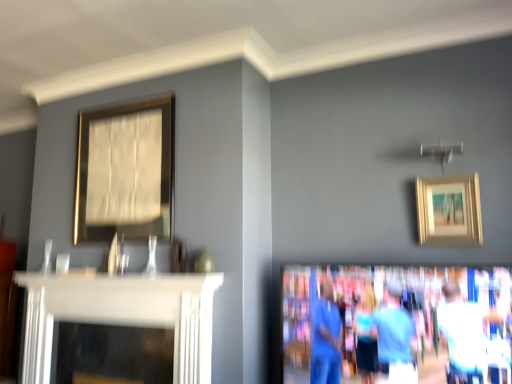
Question: Can you confirm if blue fabric couple at lower right is shorter than gold/golden frame at upper right, which ranks as the 1th picture frame in right-to-left order?

Choices:
 (A) no
 (B) yes

Answer: (A)

Question: From the image's perspective, is blue fabric couple at lower right located beneath gold/golden frame at upper right, the first picture frame from the front?

Choices:
 (A) no
 (B) yes

Answer: (B)

Question: Can we say blue fabric couple at lower right lies outside gold/golden frame at upper right, the first picture frame from the front?

Choices:
 (A) no
 (B) yes

Answer: (B)

Question: Is blue fabric couple at lower right aimed at gold/golden frame at upper right, which ranks as the 1th picture frame in right-to-left order?

Choices:
 (A) yes
 (B) no

Answer: (B)

Question: Considering the relative positions of blue fabric couple at lower right and gold/golden frame at upper right, acting as the second picture frame starting from the left, in the image provided, is blue fabric couple at lower right to the left of gold/golden frame at upper right, acting as the second picture frame starting from the left, from the viewer's perspective?

Choices:
 (A) yes
 (B) no

Answer: (A)

Question: Considering the relative sizes of blue fabric couple at lower right and gold/golden frame at upper right, the first picture frame from the front, in the image provided, is blue fabric couple at lower right taller than gold/golden frame at upper right, the first picture frame from the front,?

Choices:
 (A) yes
 (B) no

Answer: (A)

Question: Does blue fabric couple at lower right have a smaller size compared to white glossy fireplace at left?

Choices:
 (A) no
 (B) yes

Answer: (B)

Question: Is blue fabric couple at lower right not within white glossy fireplace at left?

Choices:
 (A) yes
 (B) no

Answer: (A)

Question: Is blue fabric couple at lower right wider than white glossy fireplace at left?

Choices:
 (A) no
 (B) yes

Answer: (A)

Question: Is blue fabric couple at lower right closer to the viewer compared to white glossy fireplace at left?

Choices:
 (A) no
 (B) yes

Answer: (B)

Question: Is blue fabric couple at lower right at the right side of white glossy fireplace at left?

Choices:
 (A) yes
 (B) no

Answer: (A)

Question: Is blue fabric couple at lower right next to white glossy fireplace at left and touching it?

Choices:
 (A) yes
 (B) no

Answer: (B)

Question: Does gold metallic picture frame at upper left, which ranks as the second picture frame in right-to-left order, have a greater height compared to gold/golden frame at upper right, positioned as the 2th picture frame in back-to-front order?

Choices:
 (A) no
 (B) yes

Answer: (B)